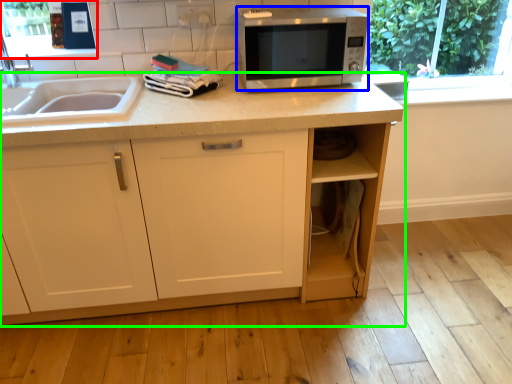
Question: Based on their relative distances, which object is farther from window screen (highlighted by a red box)? Choose from microwave oven (highlighted by a blue box) and cabinetry (highlighted by a green box).

Choices:
 (A) microwave oven
 (B) cabinetry

Answer: (A)